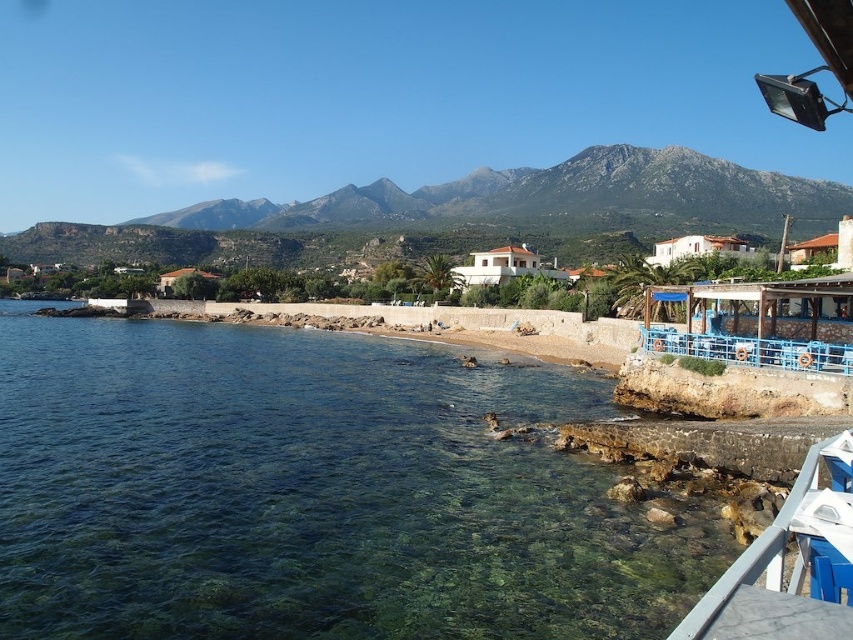
Question: Is clear water at lower left positioned before white painted wood dock at lower right?

Choices:
 (A) yes
 (B) no

Answer: (B)

Question: Can you confirm if clear water at lower left is positioned to the left of white painted wood dock at lower right?

Choices:
 (A) no
 (B) yes

Answer: (B)

Question: Does clear water at lower left have a greater width compared to white painted wood dock at lower right?

Choices:
 (A) no
 (B) yes

Answer: (B)

Question: Which of the following is the closest to the observer?

Choices:
 (A) (811, 531)
 (B) (393, 572)

Answer: (A)

Question: Which object is farther from the camera taking this photo?

Choices:
 (A) clear water at lower left
 (B) white painted wood dock at lower right

Answer: (A)